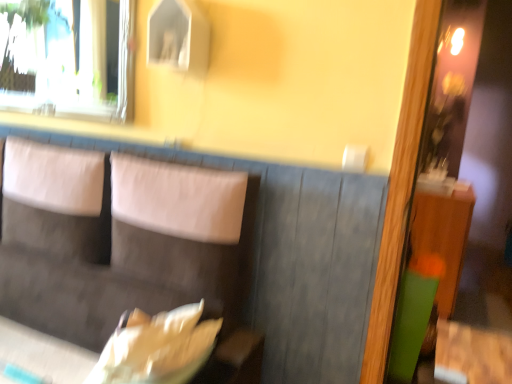
This screenshot has width=512, height=384. Find the location of `vacant area on top of suede-like gray couch at center (from a real-world perspective)`. vacant area on top of suede-like gray couch at center (from a real-world perspective) is located at coordinates (155, 137).